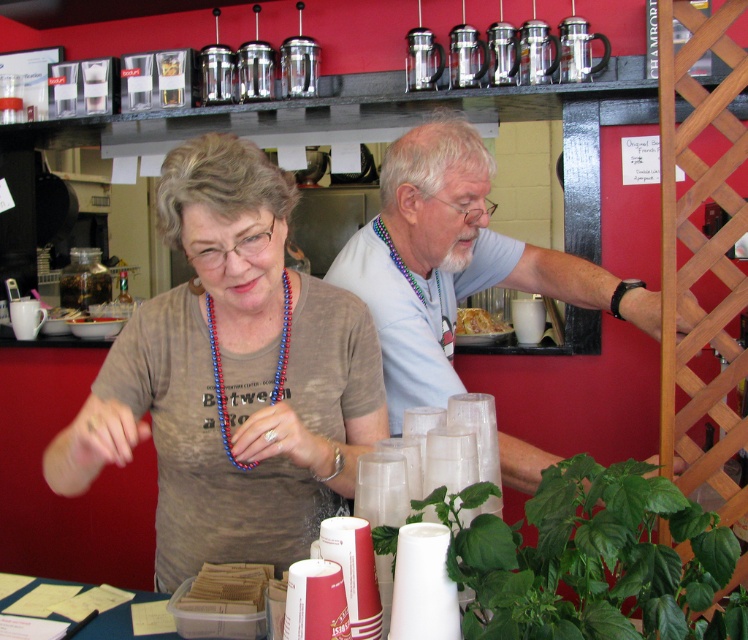
Question: Considering the relative positions of green leafy plant at center and blue beaded necklace at center in the image provided, where is green leafy plant at center located with respect to blue beaded necklace at center?

Choices:
 (A) left
 (B) right

Answer: (B)

Question: Is brown cotton shirt at center closer to the viewer compared to blue beaded necklace at center?

Choices:
 (A) yes
 (B) no

Answer: (A)

Question: Which object is positioned closest to the blue beaded necklace at center?

Choices:
 (A) matte brown shirt at center
 (B) green leafy plant at center
 (C) brown cotton shirt at center

Answer: (A)

Question: Which point appears closest to the camera in this image?

Choices:
 (A) (280, 273)
 (B) (435, 346)
 (C) (64, 456)
 (D) (257, 374)

Answer: (C)

Question: In this image, where is matte brown shirt at center located relative to blue beaded necklace at center?

Choices:
 (A) below
 (B) above

Answer: (A)

Question: Which point is closer to the camera?

Choices:
 (A) light blue t-shirt at center
 (B) brown cotton shirt at center

Answer: (B)